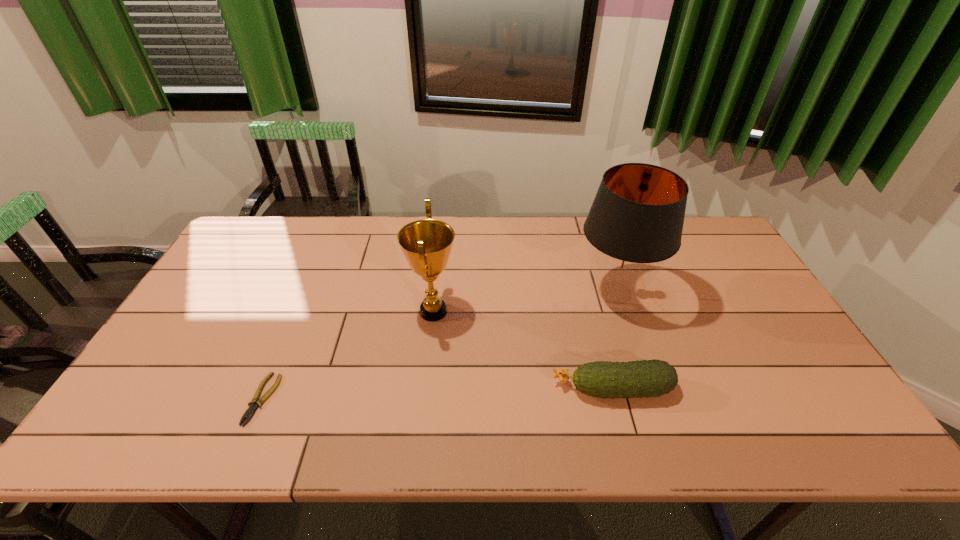
I want to click on vacant area between the second shortest object and the shortest object, so click(x=438, y=394).

You are a GUI agent. You are given a task and a screenshot of the screen. Output one action in this format:
    pyautogui.click(x=<x>, y=<y>)
    Task: Click on the empty space between the lampshade and the second shortest object
    
    Given the screenshot: What is the action you would take?
    pyautogui.click(x=613, y=341)

Locate an element on the screen. The image size is (960, 540). free space between the third object from right to left and the second shortest object is located at coordinates (523, 350).

Locate an element on the screen. This screenshot has width=960, height=540. free space between the cucumber and the leftmost object is located at coordinates (438, 394).

Locate an element on the screen. This screenshot has width=960, height=540. empty space between the second shortest object and the second object from left to right is located at coordinates (523, 350).

At what (x,y) coordinates should I click in order to perform the action: click on free spot between the award and the second shortest object. Please return your answer as a coordinate pair (x, y). This screenshot has height=540, width=960. Looking at the image, I should click on (523, 350).

Where is `unoccupied position between the cucumber and the award`? The image size is (960, 540). unoccupied position between the cucumber and the award is located at coordinates pyautogui.click(x=523, y=350).

The height and width of the screenshot is (540, 960). In order to click on empty space that is in between the leftmost object and the cucumber in this screenshot , I will do `click(438, 394)`.

Locate an element on the screen. This screenshot has width=960, height=540. blank region between the cucumber and the lampshade is located at coordinates (613, 341).

You are a GUI agent. You are given a task and a screenshot of the screen. Output one action in this format:
    pyautogui.click(x=<x>, y=<y>)
    Task: Click on the object that is the second closest to the award
    
    Given the screenshot: What is the action you would take?
    pyautogui.click(x=250, y=411)